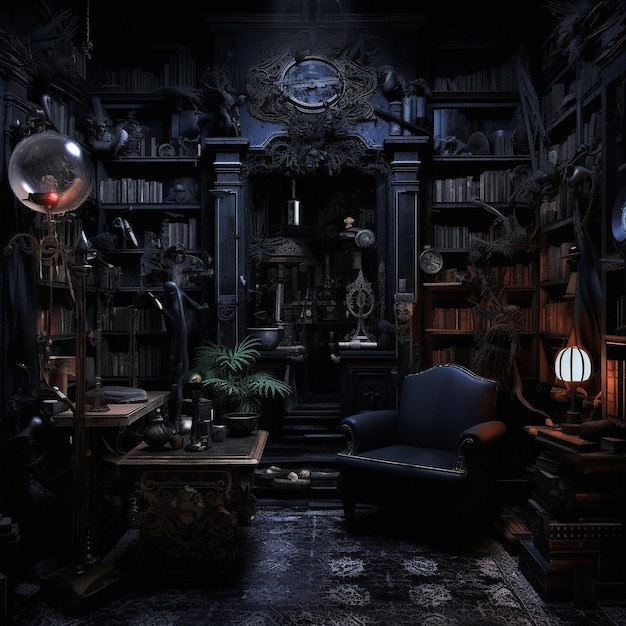
I want to click on chair, so click(x=428, y=442).